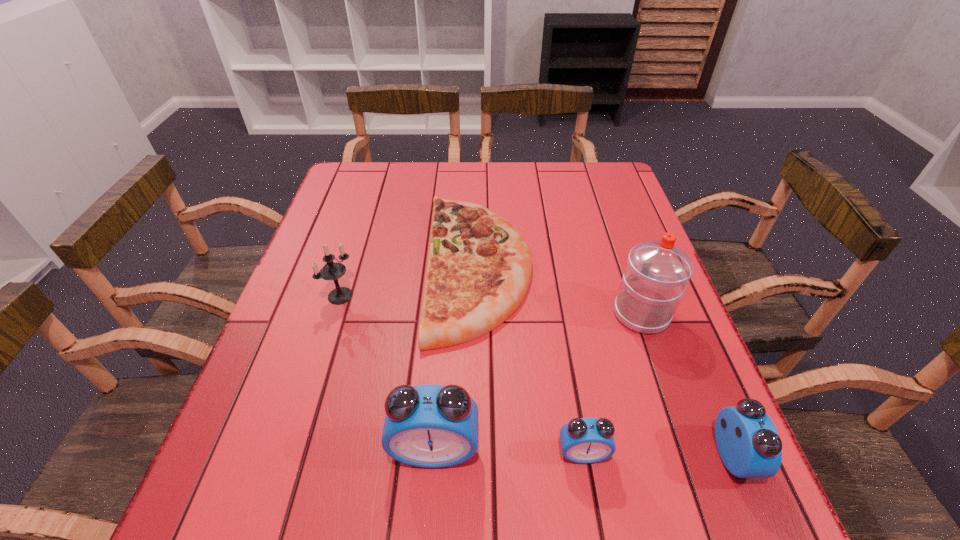
Find the location of a particular element. the leftmost alarm clock is located at coordinates (432, 426).

You are a GUI agent. You are given a task and a screenshot of the screen. Output one action in this format:
    pyautogui.click(x=<x>, y=<y>)
    Task: Click on the second alarm clock from right to left
    Image resolution: width=960 pixels, height=540 pixels.
    Given the screenshot: What is the action you would take?
    pyautogui.click(x=583, y=440)

You are a GUI agent. You are given a task and a screenshot of the screen. Output one action in this format:
    pyautogui.click(x=<x>, y=<y>)
    Task: Click on the second shortest object
    The height and width of the screenshot is (540, 960).
    Given the screenshot: What is the action you would take?
    pyautogui.click(x=583, y=440)

At what (x,y) coordinates should I click in order to perform the action: click on the third shortest object. Please return your answer as a coordinate pair (x, y). Looking at the image, I should click on (747, 440).

This screenshot has height=540, width=960. In order to click on the rightmost alarm clock in this screenshot , I will do `click(747, 440)`.

Find the location of `the shortest object`. the shortest object is located at coordinates (479, 269).

Locate an element on the screen. Image resolution: width=960 pixels, height=540 pixels. the leftmost object is located at coordinates (332, 270).

Where is `the tallest object`? the tallest object is located at coordinates (657, 271).

Find the location of `free point located 0.110m on the left of the pizza`. free point located 0.110m on the left of the pizza is located at coordinates (384, 266).

Where is `vacant area located on the back of the candle holder`? The height and width of the screenshot is (540, 960). vacant area located on the back of the candle holder is located at coordinates (352, 258).